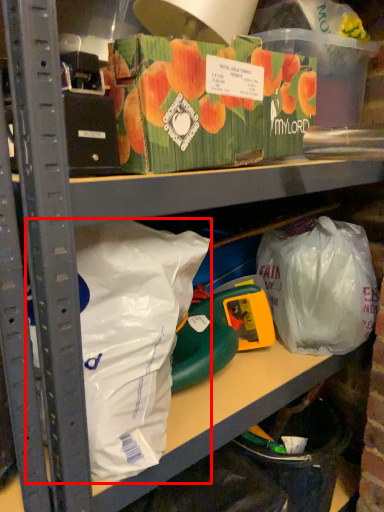
Question: From the image's perspective, where is plastic bag (annotated by the red box) located in relation to plastic bag in the image?

Choices:
 (A) above
 (B) below

Answer: (B)